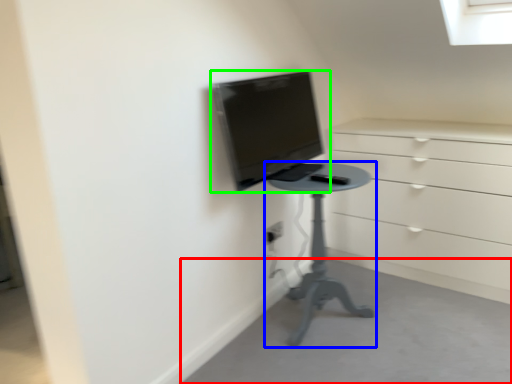
Question: Which is nearer to the concrete (highlighted by a red box)? furniture (highlighted by a blue box) or computer monitor (highlighted by a green box).

Choices:
 (A) furniture
 (B) computer monitor

Answer: (A)